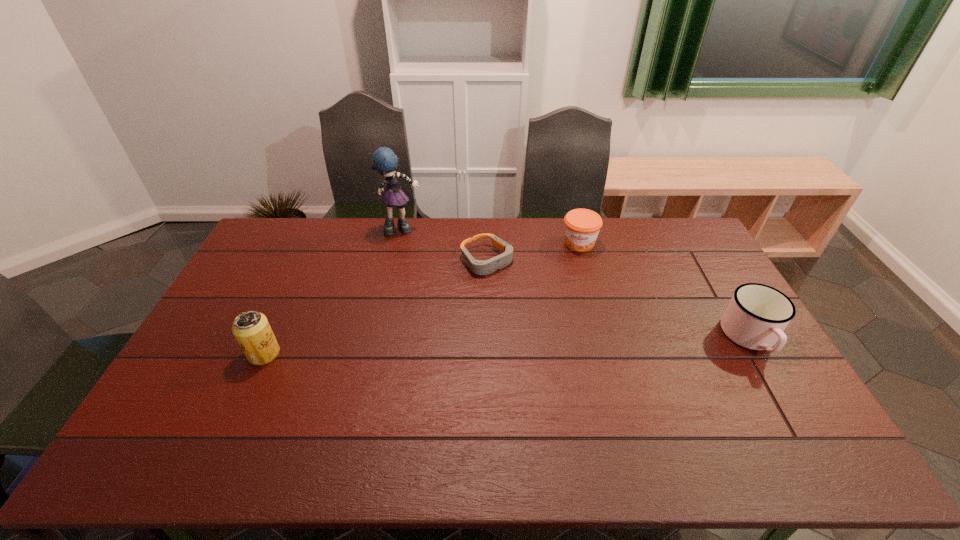
I want to click on vacant point located on the front and back of the third object from right to left, so click(x=511, y=282).

Where is `free space located on the front and back of the third object from right to left`? Image resolution: width=960 pixels, height=540 pixels. free space located on the front and back of the third object from right to left is located at coordinates (525, 295).

This screenshot has height=540, width=960. What are the coordinates of `free space located 0.270m on the front and back of the third object from right to left` in the screenshot? It's located at (553, 322).

At what (x,y) coordinates should I click in order to perform the action: click on free spot located on the front-facing side of the rag doll. Please return your answer as a coordinate pair (x, y). This screenshot has height=540, width=960. Looking at the image, I should click on [x=432, y=287].

The image size is (960, 540). What are the coordinates of `vacant space situated on the front-facing side of the rag doll` in the screenshot? It's located at (427, 278).

Where is `free space located on the front-facing side of the rag doll`? The image size is (960, 540). free space located on the front-facing side of the rag doll is located at coordinates (424, 271).

The image size is (960, 540). I want to click on free point located 0.340m on the front label of the jam, so click(566, 321).

Locate an element on the screen. This screenshot has width=960, height=540. vacant space located on the front label of the jam is located at coordinates (569, 303).

Where is `free space located on the front label of the jam`? The height and width of the screenshot is (540, 960). free space located on the front label of the jam is located at coordinates (567, 312).

Where is `goggles positioned at the far edge`? goggles positioned at the far edge is located at coordinates (479, 267).